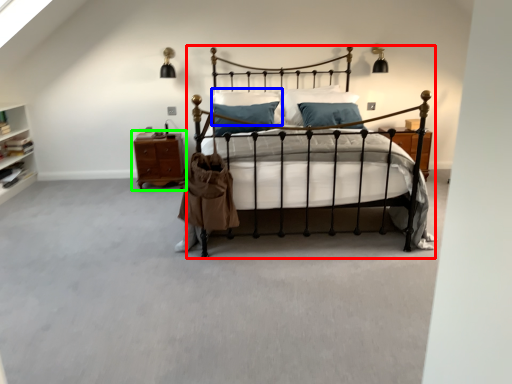
Question: Which object is the farthest from bed (highlighted by a red box)? Choose among these: pillow (highlighted by a blue box) or nightstand (highlighted by a green box).

Choices:
 (A) pillow
 (B) nightstand

Answer: (A)